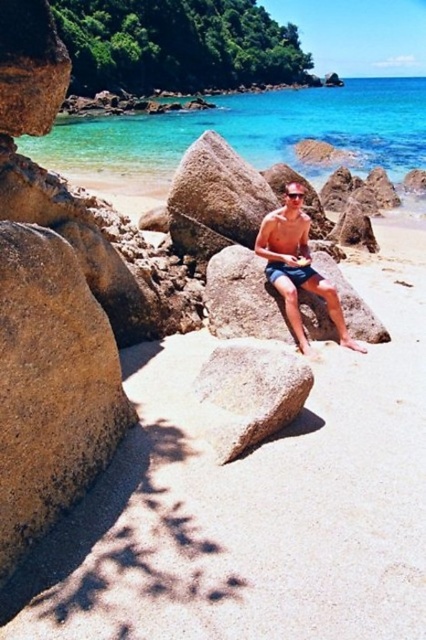
Question: Among these points, which one is nearest to the camera?

Choices:
 (A) (296, 186)
 (B) (270, 358)

Answer: (B)

Question: Is clear blue water at upper center positioned at the back of nude skin at center?

Choices:
 (A) no
 (B) yes

Answer: (A)

Question: Is gray rough rock at center to the right of nude skin at center from the viewer's perspective?

Choices:
 (A) yes
 (B) no

Answer: (B)

Question: Which point appears closest to the camera in this image?

Choices:
 (A) (129, 403)
 (B) (81, 548)
 (C) (264, 248)
 (D) (302, 227)

Answer: (B)

Question: Which of these objects is positioned farthest from the matte skin man at center?

Choices:
 (A) transparent plastic goggles at center
 (B) brown rough rock at left
 (C) clear blue water at upper center
 (D) smooth brown rock at center

Answer: (C)

Question: Can you confirm if brown rough rock at left is thinner than smooth brown rock at center?

Choices:
 (A) yes
 (B) no

Answer: (A)